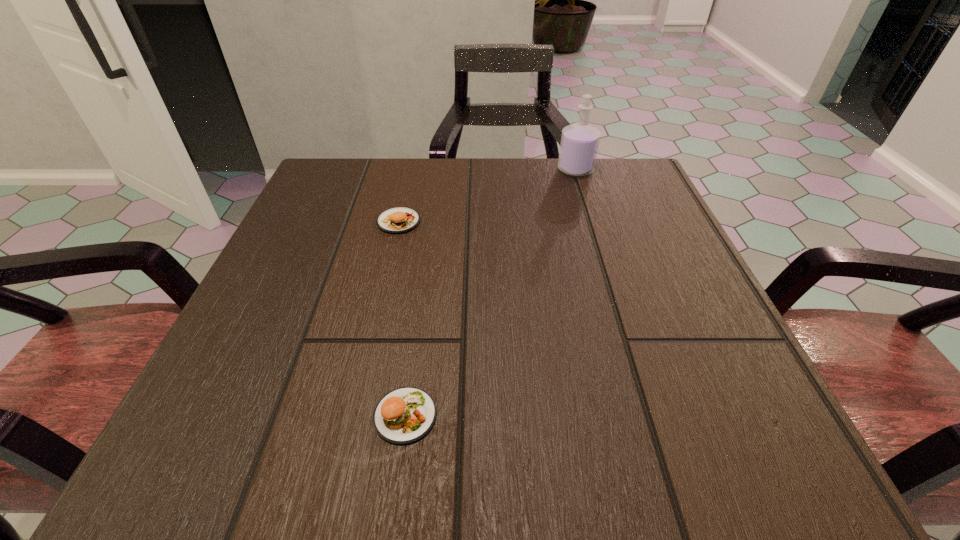
You are a GUI agent. You are given a task and a screenshot of the screen. Output one action in this format:
    pyautogui.click(x=<x>, y=<y>)
    Task: Click on the patty situated at the far edge
    The height and width of the screenshot is (540, 960).
    Given the screenshot: What is the action you would take?
    pyautogui.click(x=397, y=220)

Find the location of a particular element. Image resolution: width=960 pixels, height=540 pixels. object positioned at the near edge is located at coordinates (404, 415).

Where is `object at the right edge`? The width and height of the screenshot is (960, 540). object at the right edge is located at coordinates (579, 145).

I want to click on object located in the far right corner section of the desktop, so click(x=579, y=145).

This screenshot has width=960, height=540. I want to click on free spot at the far edge of the desktop, so click(x=381, y=211).

You are a GUI agent. You are given a task and a screenshot of the screen. Output one action in this format:
    pyautogui.click(x=<x>, y=<y>)
    Task: Click on the vacant area at the near edge of the desktop
    The width and height of the screenshot is (960, 540).
    Given the screenshot: What is the action you would take?
    334,446

At what (x,y) coordinates should I click in order to perform the action: click on vacant space at the left edge of the desktop. Please return your answer as a coordinate pair (x, y). The width and height of the screenshot is (960, 540). Looking at the image, I should click on (310, 267).

Where is `vacant region at the right edge of the desktop`? The width and height of the screenshot is (960, 540). vacant region at the right edge of the desktop is located at coordinates pos(619,232).

The height and width of the screenshot is (540, 960). Find the location of `vacant region at the far left corner`. vacant region at the far left corner is located at coordinates (314, 194).

At what (x,y) coordinates should I click in order to perform the action: click on vacant space at the near left corner. Please return your answer as a coordinate pair (x, y). Image resolution: width=960 pixels, height=540 pixels. Looking at the image, I should click on click(250, 458).